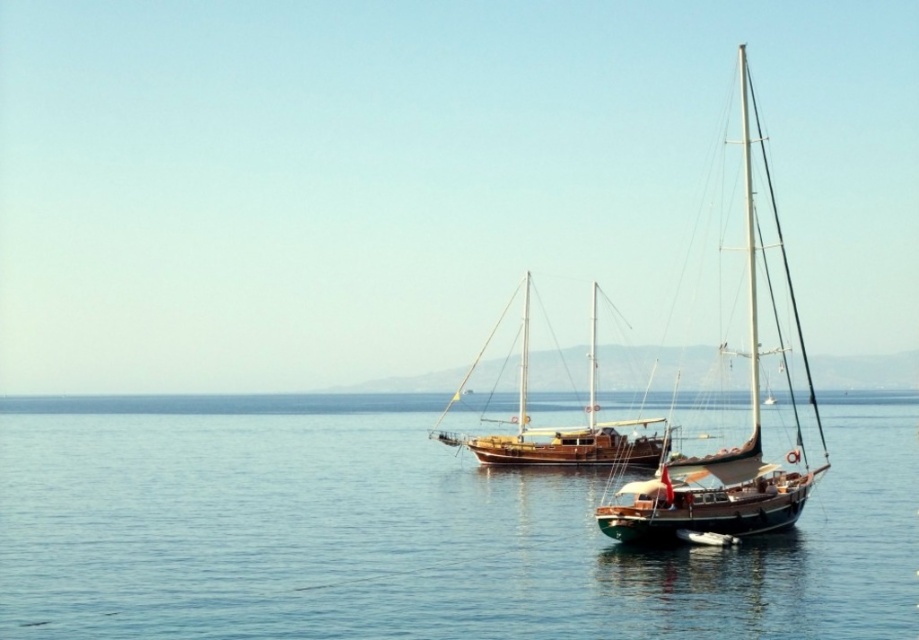
You are a photographer planning to capture the blue water at center and the wooden sailboat at right in a single frame. Based on their sizes in the image, which object would you focus on first to ensure both are clearly visible in the photo?

The wooden sailboat at right is larger than the blue water at center, so focusing on the wooden sailboat at right first would help ensure both are clearly visible in the photo.